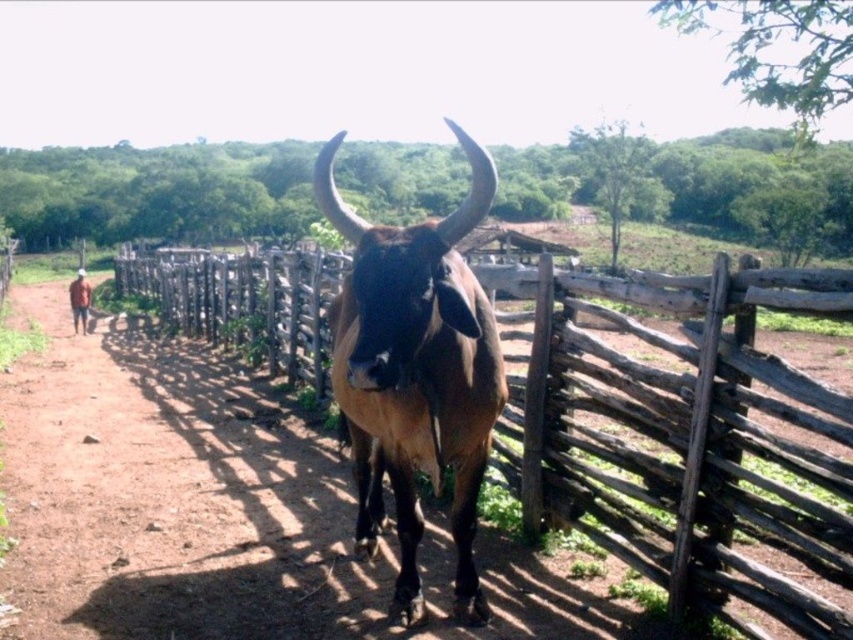
You are a photographer trying to capture a clear shot of the brown glossy bull at center. However, you notice the brown wooden fence at center is blocking your view. Can you move closer to the bull to get a better shot without the fence obstructing the view?

The brown wooden fence at center is further to the viewer than the brown glossy bull at center, so moving closer to the bull would bring it forward relative to the fence, potentially reducing obstruction. However, since both are at center, careful positioning might still be needed to avoid partial overlap.

You are a photographer trying to capture the brown glossy bull at center while ensuring the brown wooden fence at center is visible in the background. Based on their positions, is the fence to the left or right of the bull?

The brown wooden fence at center is positioned on the left side of brown glossy bull at center, so the fence is to the left of the bull.

In the scene shown: You are a farmer checking the boundaries of your property. You notice the brown wooden fence at center and the brown glossy bull at center. Which object takes up more space in the image?

The brown wooden fence at center has a larger size compared to the brown glossy bull at center, so the brown wooden fence at center takes up more space in the image.